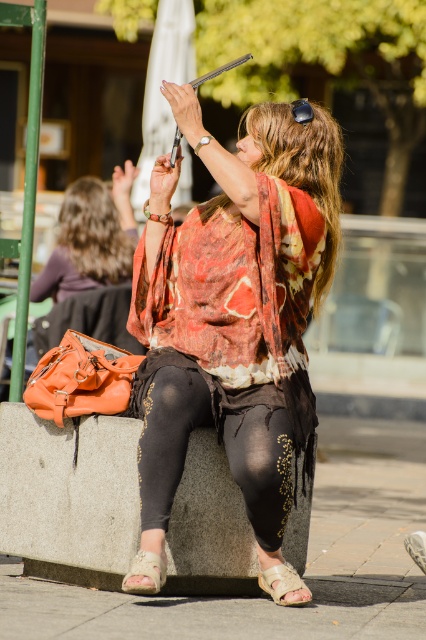
Question: Estimate the real-world distances between objects in this image. Which object is farther from the black matte leggings at center?

Choices:
 (A) black matte goggles at upper center
 (B) leather jacket at center
 (C) matte black phone at upper center

Answer: (B)

Question: Is matte black phone at upper center wider than black matte goggles at upper center?

Choices:
 (A) no
 (B) yes

Answer: (B)

Question: Which point is closer to the camera taking this photo?

Choices:
 (A) (39, 276)
 (B) (265, 260)

Answer: (B)

Question: Considering the relative positions of leather jacket at center and black matte goggles at upper center in the image provided, where is leather jacket at center located with respect to black matte goggles at upper center?

Choices:
 (A) right
 (B) left

Answer: (B)

Question: Is leather jacket at center thinner than black matte goggles at upper center?

Choices:
 (A) yes
 (B) no

Answer: (B)

Question: Which point is closer to the camera?

Choices:
 (A) black matte leggings at center
 (B) matte black phone at upper center
 (C) black matte goggles at upper center

Answer: (B)